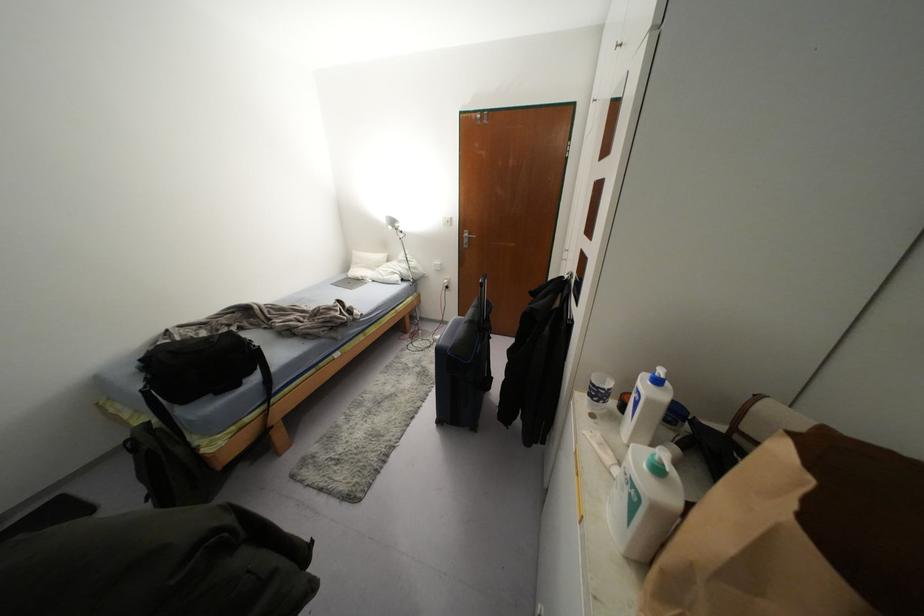
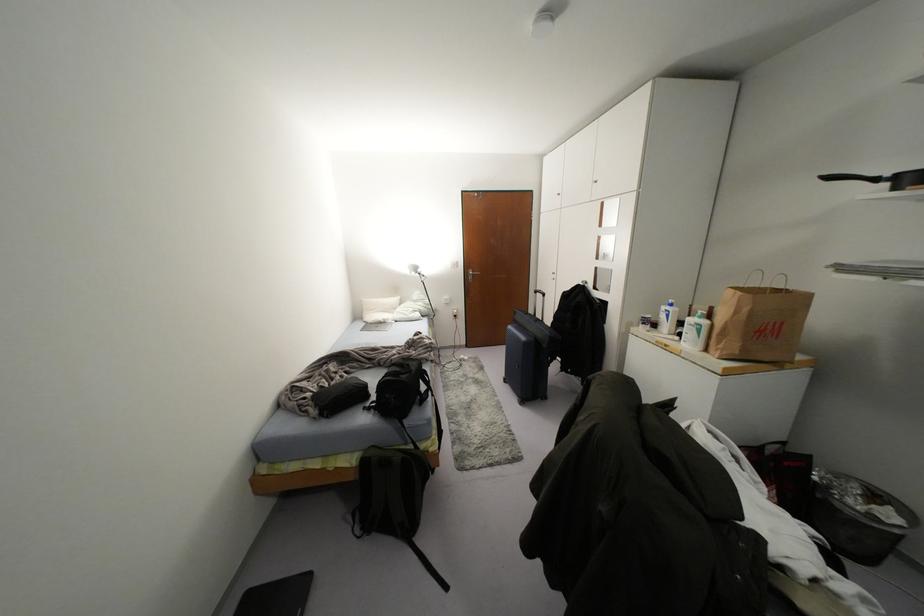
The point at [465,241] is marked in the first image. Where is the corresponding point in the second image?

(469, 277)